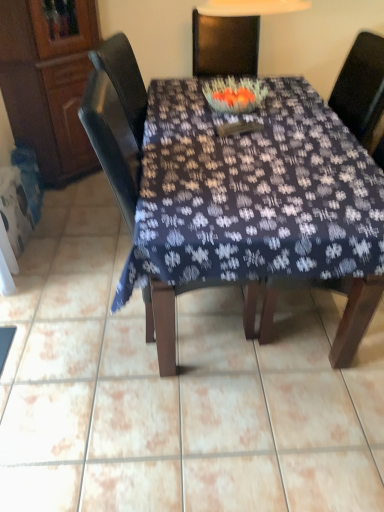
Find the location of a particular element. dark fabric table at center is located at coordinates (259, 208).

Describe the element at coordinates (49, 81) in the screenshot. This screenshot has width=384, height=512. I see `wooden cabinet at left` at that location.

Find the location of a particular element. wooden chair at center, which is counted as the 1th chair, starting from the right is located at coordinates (361, 86).

Which is correct: wooden cabinet at left is inside dark fabric table at center, or outside of it?

wooden cabinet at left is outside dark fabric table at center.

Does wooden cabinet at left have a larger size compared to dark fabric table at center?

Incorrect, wooden cabinet at left is not larger than dark fabric table at center.

Which object is wider, wooden cabinet at left or dark fabric table at center?

dark fabric table at center is wider.

Between wooden cabinet at left and dark fabric table at center, which one has less height?

Standing shorter between the two is dark fabric table at center.

Is point (239, 236) closer to camera compared to point (24, 36)?

Yes, it is in front of point (24, 36).

From the image's perspective, who appears lower, dark fabric table at center or wooden cabinet at left?

dark fabric table at center, from the image's perspective.

Looking at this image, from a real-world perspective, does dark fabric table at center sit lower than wooden cabinet at left?

Indeed, from a real-world perspective, dark fabric table at center is positioned beneath wooden cabinet at left.

Considering the points (284, 233) and (125, 152), which point is behind, point (284, 233) or point (125, 152)?

Positioned behind is point (125, 152).

Is dark fabric table at center shorter than matte dark wood chair at center, the first chair from the left?

Indeed, dark fabric table at center has a lesser height compared to matte dark wood chair at center, the first chair from the left.

In terms of size, does dark fabric table at center appear bigger or smaller than matte dark wood chair at center, the first chair from the left?

In the image, dark fabric table at center appears to be larger than matte dark wood chair at center, the first chair from the left.

In order to click on desk lying in front of the matte dark wood chair at center, the second chair from the right in this screenshot , I will do `click(259, 208)`.

Considering the relative positions of wooden chair at center, marked as the 2th chair in a left-to-right arrangement, and wooden cabinet at left in the image provided, is wooden chair at center, marked as the 2th chair in a left-to-right arrangement, behind wooden cabinet at left?

No, the depth of wooden chair at center, marked as the 2th chair in a left-to-right arrangement, is less than that of wooden cabinet at left.

Could you measure the distance between wooden chair at center, marked as the 2th chair in a left-to-right arrangement, and wooden cabinet at left?

5.63 feet.

Is wooden chair at center, marked as the 2th chair in a left-to-right arrangement, taller than wooden cabinet at left?

No, wooden chair at center, marked as the 2th chair in a left-to-right arrangement, is not taller than wooden cabinet at left.

Which of these two, wooden chair at center, which is counted as the 1th chair, starting from the right, or wooden cabinet at left, is bigger?

wooden chair at center, which is counted as the 1th chair, starting from the right, is bigger.

In the image, is wooden cabinet at left on the left side or the right side of wooden chair at center, which is counted as the 1th chair, starting from the right?

Based on their positions, wooden cabinet at left is located to the left of wooden chair at center, which is counted as the 1th chair, starting from the right.

From a real-world perspective, which object rests below the other?

wooden chair at center, marked as the 2th chair in a left-to-right arrangement, is physically lower.

Find the location of a particular element. This screenshot has width=384, height=512. cabinetry above the wooden chair at center, which is counted as the 1th chair, starting from the right (from the image's perspective) is located at coordinates (49, 81).

Is wooden cabinet at left taller or shorter than wooden chair at center, marked as the 2th chair in a left-to-right arrangement?

wooden cabinet at left is taller than wooden chair at center, marked as the 2th chair in a left-to-right arrangement.

Does point (268, 310) lie in front of point (333, 94)?

Yes.

Does dark fabric table at center have a greater height compared to wooden chair at center, which is counted as the 1th chair, starting from the right?

No, dark fabric table at center is not taller than wooden chair at center, which is counted as the 1th chair, starting from the right.

Considering the sizes of objects dark fabric table at center and wooden chair at center, marked as the 2th chair in a left-to-right arrangement, in the image provided, who is thinner, dark fabric table at center or wooden chair at center, marked as the 2th chair in a left-to-right arrangement,?

wooden chair at center, marked as the 2th chair in a left-to-right arrangement.

Considering the relative positions of matte dark wood chair at center, the second chair from the right, and dark fabric table at center in the image provided, is matte dark wood chair at center, the second chair from the right, to the right of dark fabric table at center from the viewer's perspective?

Incorrect, matte dark wood chair at center, the second chair from the right, is not on the right side of dark fabric table at center.

Which object is closer to the camera, matte dark wood chair at center, the second chair from the right, or dark fabric table at center?

dark fabric table at center.

Where is `desk below the wooden cabinet at left (from the image's perspective)`? This screenshot has width=384, height=512. desk below the wooden cabinet at left (from the image's perspective) is located at coordinates (259, 208).

Find the location of a particular element. This screenshot has width=384, height=512. desk that is in front of the wooden cabinet at left is located at coordinates (259, 208).

From the picture: Estimate the real-world distances between objects in this image. Which object is closer to matte dark wood chair at center, the first chair from the left, wooden cabinet at left or dark fabric table at center?

dark fabric table at center.

Which object lies further to the anchor point wooden cabinet at left, matte dark wood chair at center, the second chair from the right, or wooden chair at center, which is counted as the 1th chair, starting from the right?

wooden chair at center, which is counted as the 1th chair, starting from the right, lies further to wooden cabinet at left than the other object.

Based on their spatial positions, is wooden cabinet at left or dark fabric table at center further from wooden chair at center, which is counted as the 1th chair, starting from the right?

Based on the image, wooden cabinet at left appears to be further to wooden chair at center, which is counted as the 1th chair, starting from the right.

Looking at the image, which one is located further to matte dark wood chair at center, the first chair from the left, dark fabric table at center or wooden cabinet at left?

Among the two, wooden cabinet at left is located further to matte dark wood chair at center, the first chair from the left.

Considering their positions, is dark fabric table at center positioned closer to wooden cabinet at left than wooden chair at center, which is counted as the 1th chair, starting from the right?

dark fabric table at center lies closer to wooden cabinet at left than the other object.

When comparing their distances from wooden chair at center, marked as the 2th chair in a left-to-right arrangement, does dark fabric table at center or wooden cabinet at left seem further?

Among the two, wooden cabinet at left is located further to wooden chair at center, marked as the 2th chair in a left-to-right arrangement.

Estimate the real-world distances between objects in this image. Which object is closer to wooden cabinet at left, dark fabric table at center or matte dark wood chair at center, the first chair from the left?

matte dark wood chair at center, the first chair from the left, is positioned closer to the anchor wooden cabinet at left.

Considering their positions, is matte dark wood chair at center, the second chair from the right, positioned further to dark fabric table at center than wooden cabinet at left?

The object further to dark fabric table at center is wooden cabinet at left.

This screenshot has height=512, width=384. Find the location of `desk between matte dark wood chair at center, the first chair from the left, and wooden chair at center, which is counted as the 1th chair, starting from the right, from left to right`. desk between matte dark wood chair at center, the first chair from the left, and wooden chair at center, which is counted as the 1th chair, starting from the right, from left to right is located at coordinates (259, 208).

Image resolution: width=384 pixels, height=512 pixels. What are the coordinates of `chair located between wooden cabinet at left and wooden chair at center, which is counted as the 1th chair, starting from the right, in the left-right direction` in the screenshot? It's located at (116, 133).

I want to click on desk between wooden cabinet at left and wooden chair at center, which is counted as the 1th chair, starting from the right, in the horizontal direction, so click(259, 208).